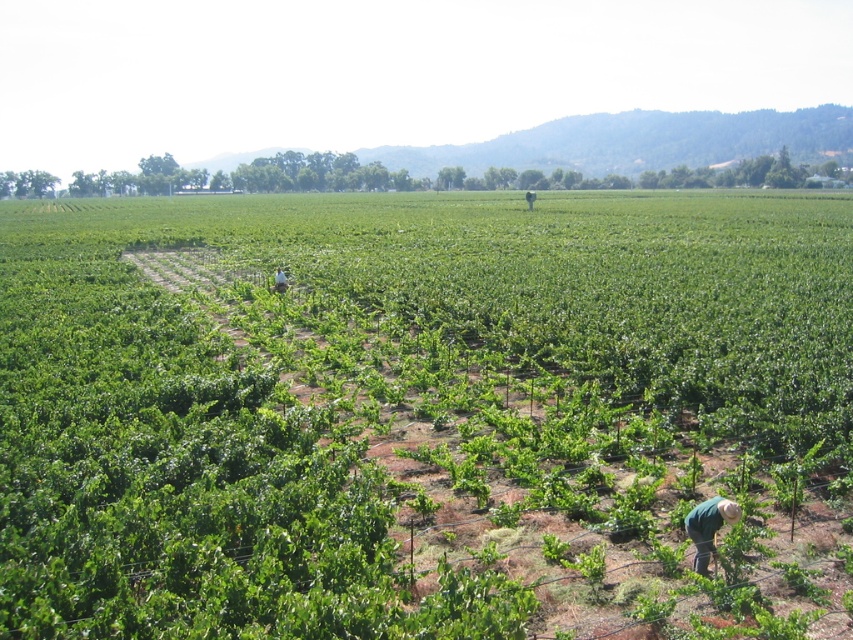
You are standing at the viewpoint of the image and want to reach the point marked as point (694, 545). If you walk directly towards it, how far will you have to walk?

The distance between point (694, 545) and the viewer is 6.80 meters, so you will have to walk 6.80 meters to reach it.

You are standing at the origin point in the vineyard and see two points marked in the scene. Which point, point (602, 243) or point (718, 515), is closer to you?

Point (718, 515) is closer to you because it is in front of point (602, 243) according to their positions.

You are a vineyard worker checking the growth of the plants. You notice the green leafy plants at center and the green fabric at center. Which one is taller?

The green leafy plants at center are taller than the green fabric at center.